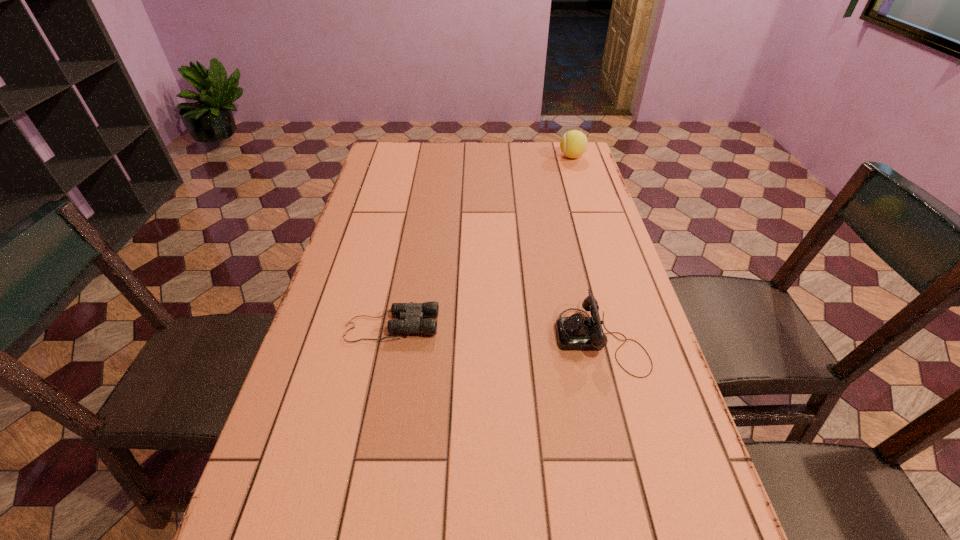
In order to click on free space between the shortest object and the tallest object in this screenshot , I will do `click(482, 241)`.

Locate an element on the screen. The image size is (960, 540). vacant space that's between the farthest object and the binoculars is located at coordinates (482, 241).

The image size is (960, 540). What are the coordinates of `unoccupied position between the tennis ball and the binoculars` in the screenshot? It's located at (482, 241).

Locate which object is the closest to the tallest object. Please provide its 2D coordinates. Your answer should be formatted as a tuple, i.e. [(x, y)], where the tuple contains the x and y coordinates of a point satisfying the conditions above.

[(576, 332)]

Identify the location of object identified as the closest to the telephone. This screenshot has height=540, width=960. (413, 313).

Locate an element on the screen. The image size is (960, 540). vacant space that satisfies the following two spatial constraints: 1. on the front side of the farthest object; 2. on the front-facing side of the telephone is located at coordinates (629, 338).

Find the location of a particular element. The width and height of the screenshot is (960, 540). free space in the image that satisfies the following two spatial constraints: 1. on the front side of the tennis ball; 2. on the front-facing side of the telephone is located at coordinates (629, 338).